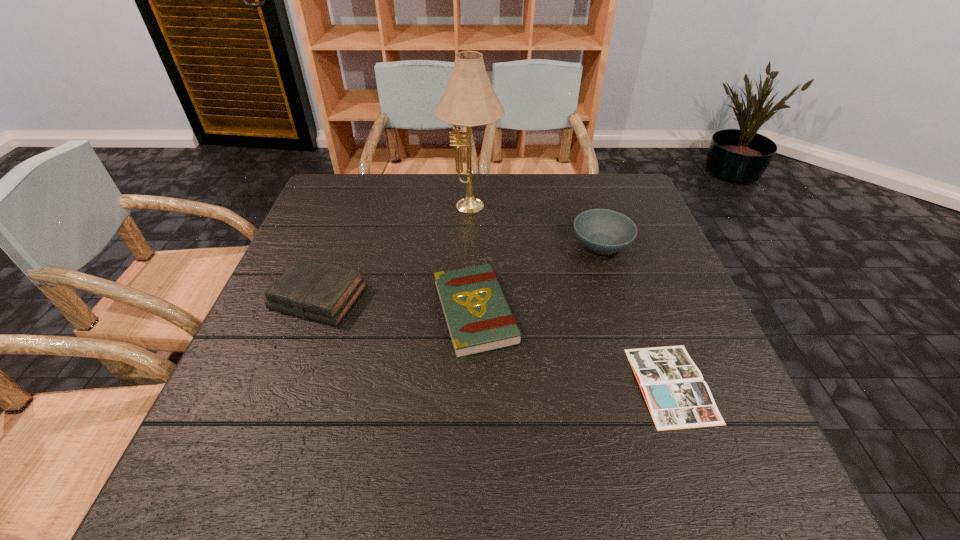
I want to click on the closest object relative to the tallest object, so click(602, 231).

You are a GUI agent. You are given a task and a screenshot of the screen. Output one action in this format:
    pyautogui.click(x=<x>, y=<y>)
    Task: Click on the second closest book to the second book from right to left
    Image resolution: width=960 pixels, height=540 pixels.
    Given the screenshot: What is the action you would take?
    pyautogui.click(x=677, y=397)

Locate an element on the screen. The image size is (960, 540). the third closest book relative to the soup bowl is located at coordinates (320, 291).

Find the location of `free region that satisfies the following two spatial constraints: 1. on the front side of the rightmost book; 2. on the left side of the second tallest object`. free region that satisfies the following two spatial constraints: 1. on the front side of the rightmost book; 2. on the left side of the second tallest object is located at coordinates (646, 384).

This screenshot has width=960, height=540. I want to click on vacant position in the image that satisfies the following two spatial constraints: 1. on the front side of the soup bowl; 2. on the left side of the lampshade, so click(x=470, y=245).